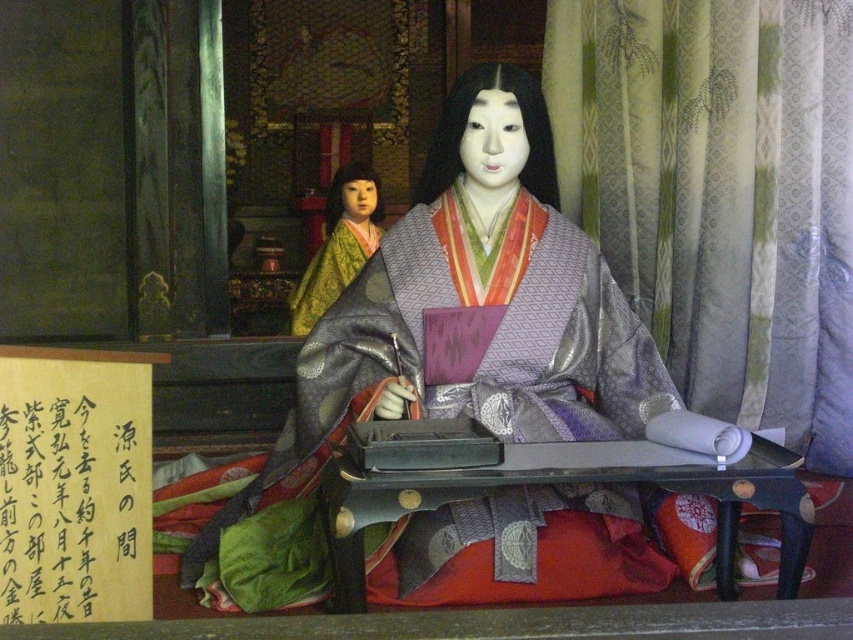
Can you confirm if silky green curtain at right is smaller than silky purple kimono at center?

Yes, silky green curtain at right is smaller than silky purple kimono at center.

Can you confirm if silky green curtain at right is positioned to the left of silky purple kimono at center?

Incorrect, silky green curtain at right is not on the left side of silky purple kimono at center.

Who is more forward, (x=628, y=221) or (x=451, y=541)?

Positioned in front is point (x=451, y=541).

Image resolution: width=853 pixels, height=640 pixels. In order to click on silky green curtain at right in this screenshot , I will do point(720,195).

How much distance is there between silky green curtain at right and silky green kimono at left?

The distance of silky green curtain at right from silky green kimono at left is 6.35 feet.

Between silky green curtain at right and silky green kimono at left, which one appears on the left side from the viewer's perspective?

silky green kimono at left

Is point (721, 336) more distant than point (302, 298)?

No, (721, 336) is in front of (302, 298).

Where is `silky green curtain at right`? silky green curtain at right is located at coordinates (720, 195).

Does silky purple kimono at center appear over silky green kimono at left?

No.

Is silky purple kimono at center closer to the viewer compared to silky green kimono at left?

That is True.

Is point (509, 417) less distant than point (321, 292)?

That is True.

Locate an element on the screen. silky purple kimono at center is located at coordinates (469, 342).